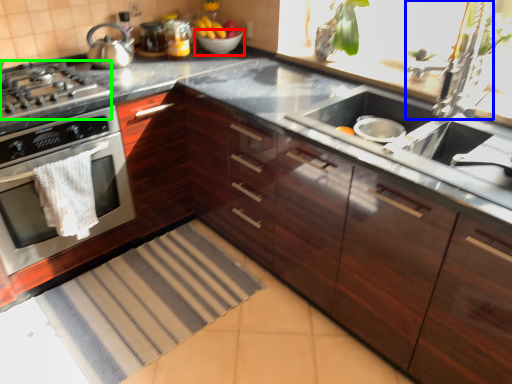
Question: Considering the real-world distances, which object is farthest from bowl (highlighted by a red box)? faucet (highlighted by a blue box) or gas stove (highlighted by a green box)?

Choices:
 (A) faucet
 (B) gas stove

Answer: (A)